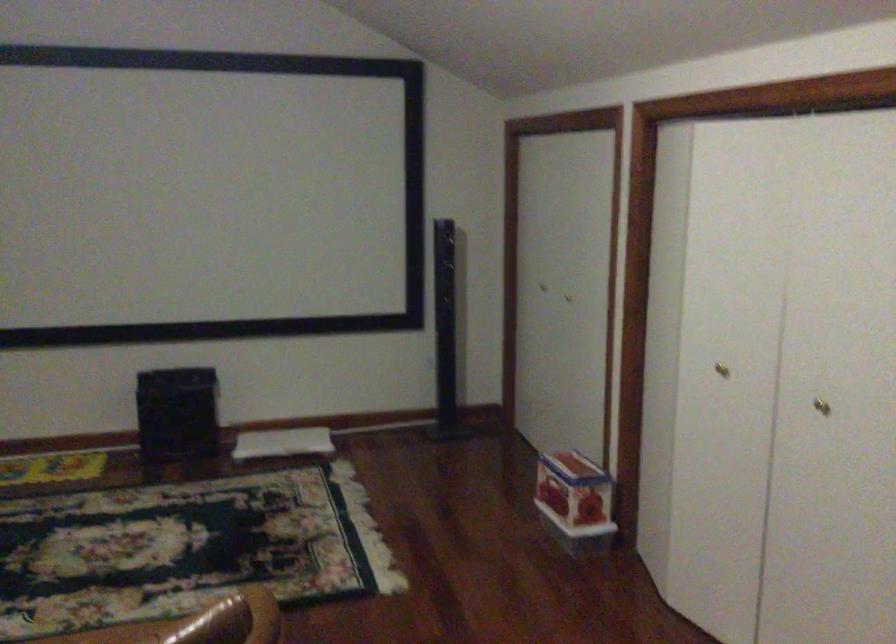
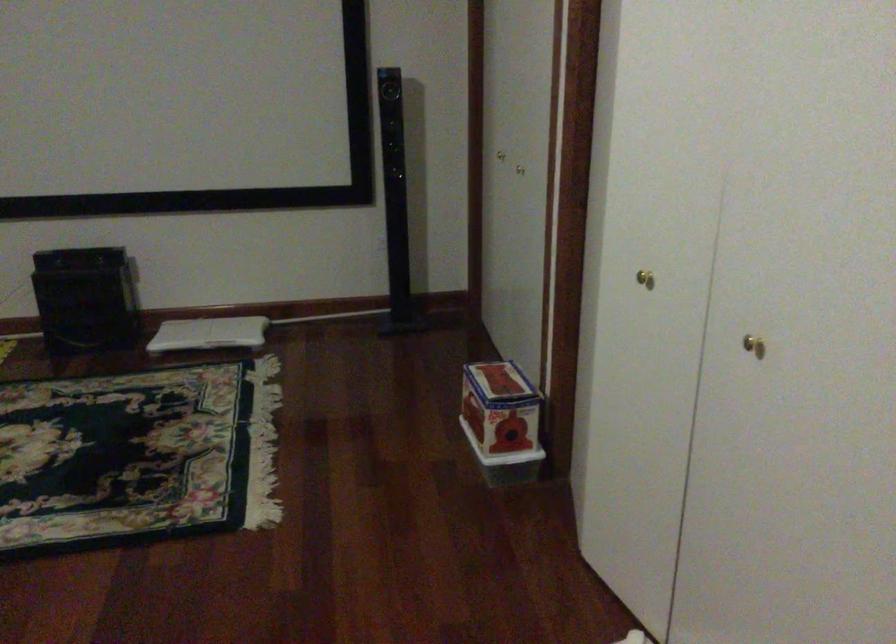
Based on the photo, what movement of the cameraman would produce the second image?

The cameraman moved toward right, forward.